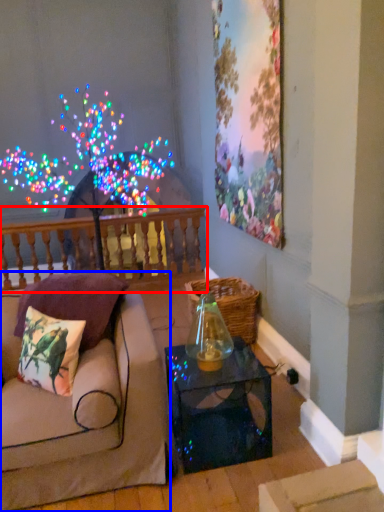
Question: Which of the following is the closest to the observer, balustrade (highlighted by a red box) or studio couch (highlighted by a blue box)?

Choices:
 (A) balustrade
 (B) studio couch

Answer: (B)